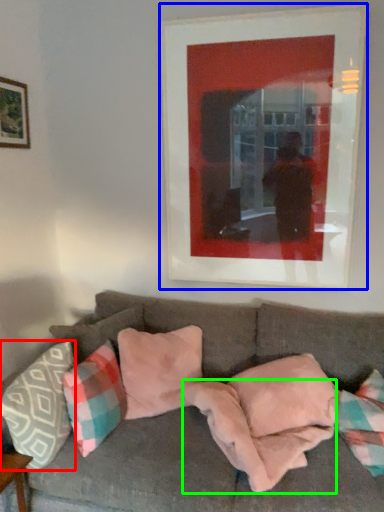
Question: Considering the real-world distances, which object is farthest from pillow (highlighted by a red box)? picture frame (highlighted by a blue box) or blanket (highlighted by a green box)?

Choices:
 (A) picture frame
 (B) blanket

Answer: (A)